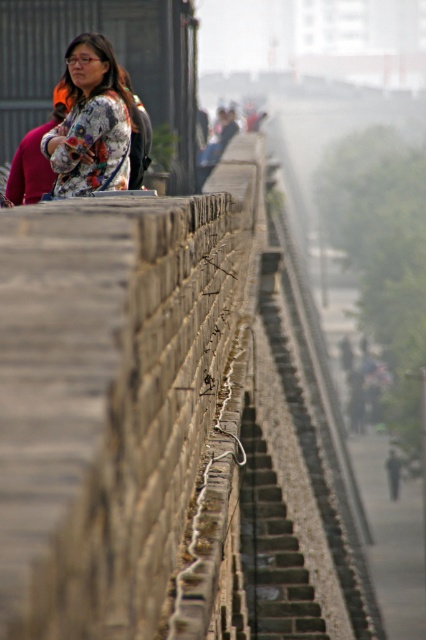
You are standing on the brown stone ledge at upper center and want to walk down to the dark gray stone stairs at center. Which direction should you face to descend?

You should face downward towards the dark gray stone stairs at center because the brown stone ledge at upper center is closer to the viewer, meaning the stairs are below it.

You are standing at the base of the dark gray stone stairs at center and want to reach the top. If your average walking speed is 1.5 meters per second, how long would it take you to climb the stairs?

The dark gray stone stairs at center are 11.75 meters away from the viewer. At a speed of 1.5 meters per second, it would take approximately 7.83 seconds to climb the stairs.